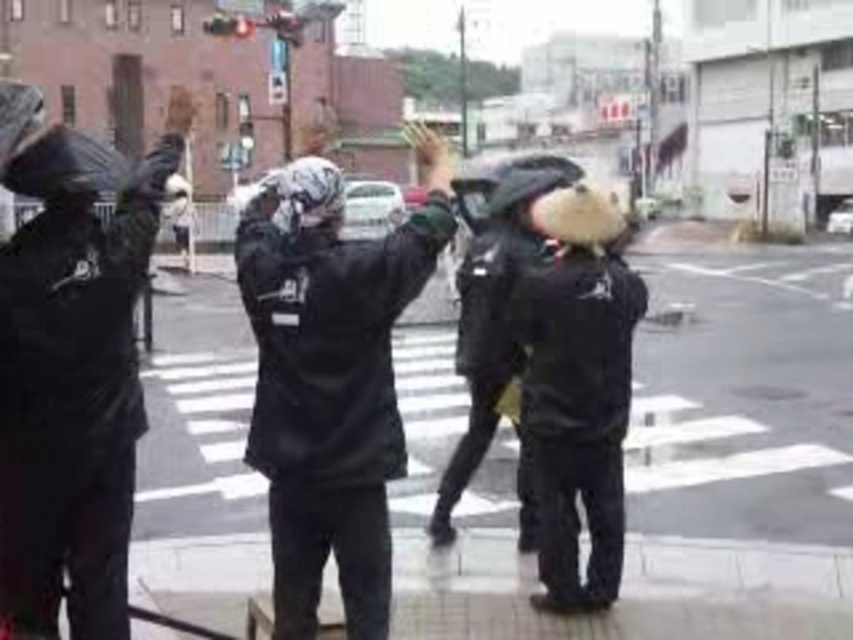
Does matte black jacket at left have a lesser width compared to matte black jacket at center?

Indeed, matte black jacket at left has a lesser width compared to matte black jacket at center.

Is matte black jacket at left behind matte black jacket at center?

No, it is in front of matte black jacket at center.

Is point (39, 442) behind point (386, 464)?

No, it is in front of (386, 464).

Find the location of a particular element. Image resolution: width=853 pixels, height=640 pixels. matte black jacket at left is located at coordinates (68, 371).